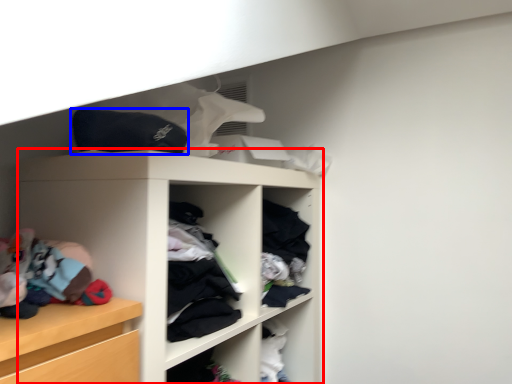
Question: Among these objects, which one is farthest to the camera, shelf (highlighted by a red box) or clothing (highlighted by a blue box)?

Choices:
 (A) shelf
 (B) clothing

Answer: (B)